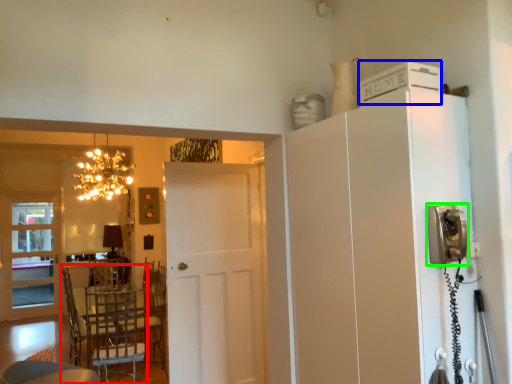
Question: Considering the real-world distances, which object is closest to chair (highlighted by a red box)? appliance (highlighted by a blue box) or appliance (highlighted by a green box).

Choices:
 (A) appliance
 (B) appliance

Answer: (B)